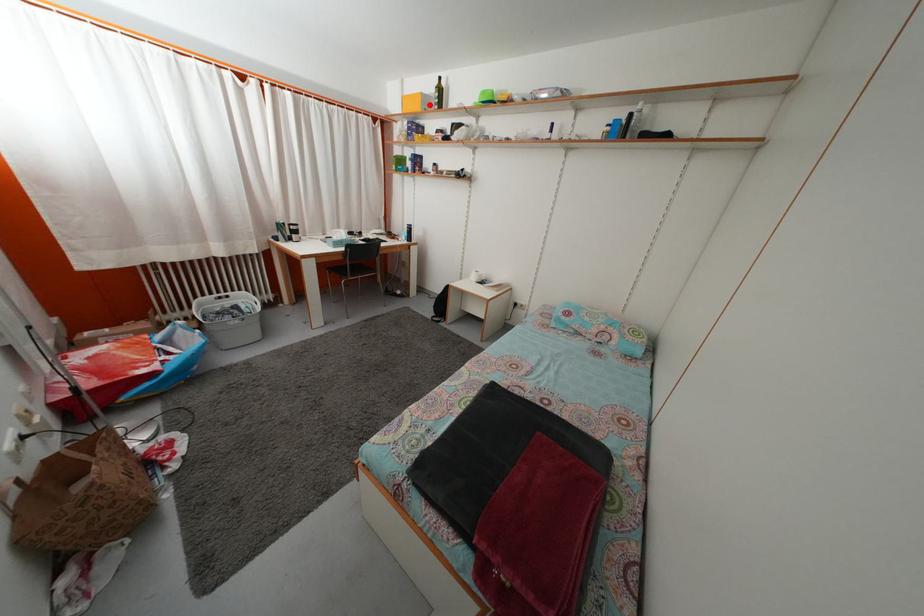
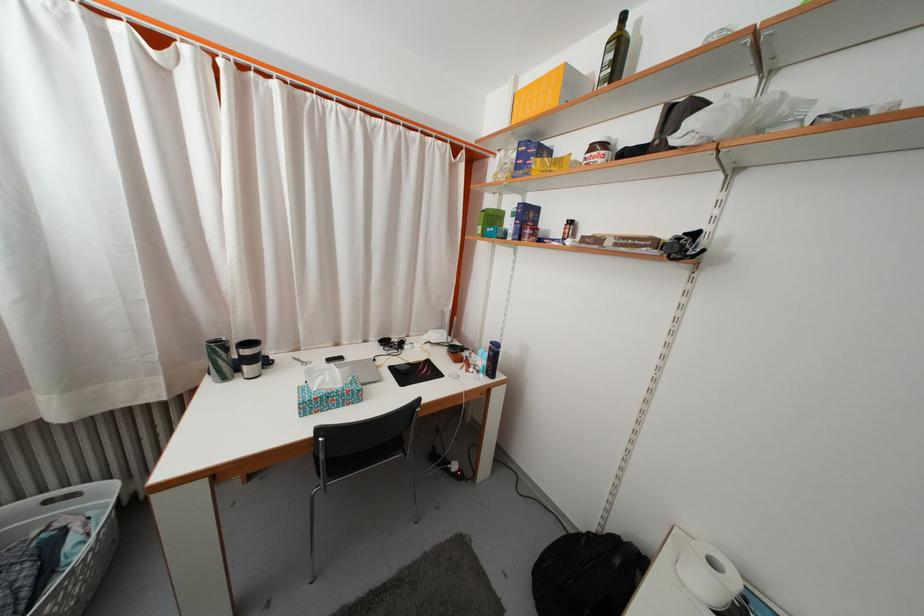
Find the pixel in the second image that matches the highlighted location in the first image.

(575, 84)